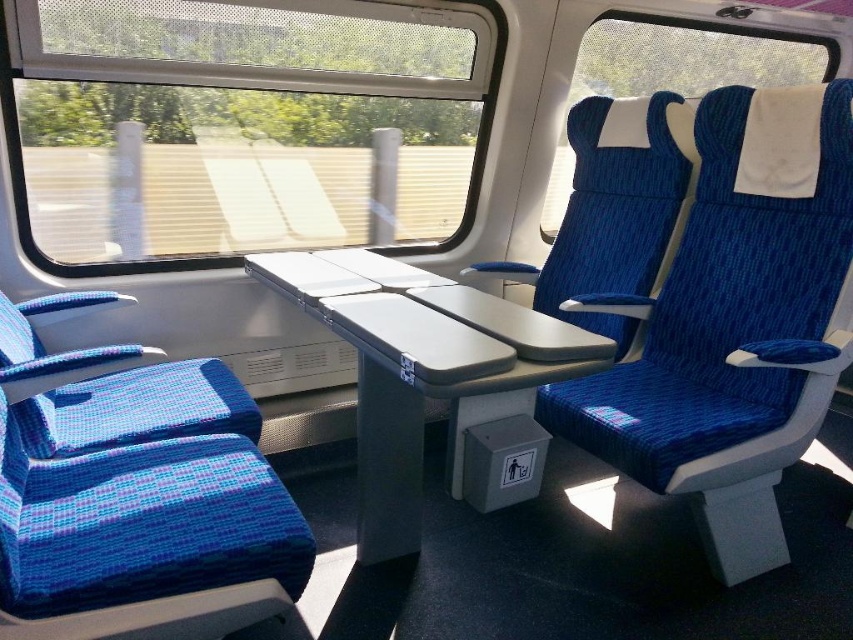
You are sitting in the train carriage and want to place your bag on the seat closest to the window. Which seat should you choose between the blue textured fabric seat at left and the blue fabric chair at center?

The blue textured fabric seat at left is to the left of the blue fabric chair at center. Since the window is above each seat, the blue textured fabric seat at left has its own window. Therefore, you should choose the blue textured fabric seat at left as it is closest to its window.

You are sitting in the train carriage and need to place your laptop on the foldable table between the blue fabric seat at center and the blue fabric chair at center. Which side of the table should you place it on to ensure it stays stable?

The blue fabric seat at center is positioned on the right side of the blue fabric chair at center. Therefore, the foldable table is between them, so placing the laptop on the right side of the table near the blue fabric seat at center would keep it stable as it aligns with the seating arrangement.